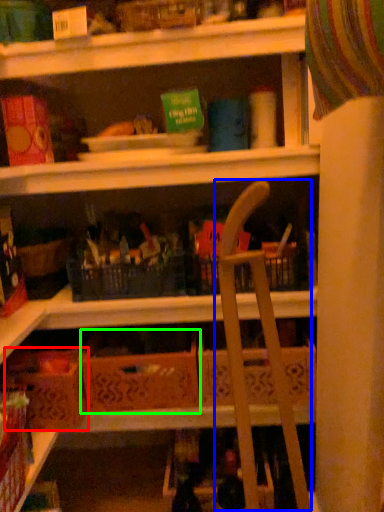
Question: Considering the real-world distances, which object is farthest from cardboard box (highlighted by a red box)? folding chair (highlighted by a blue box) or cardboard box (highlighted by a green box)?

Choices:
 (A) folding chair
 (B) cardboard box

Answer: (A)